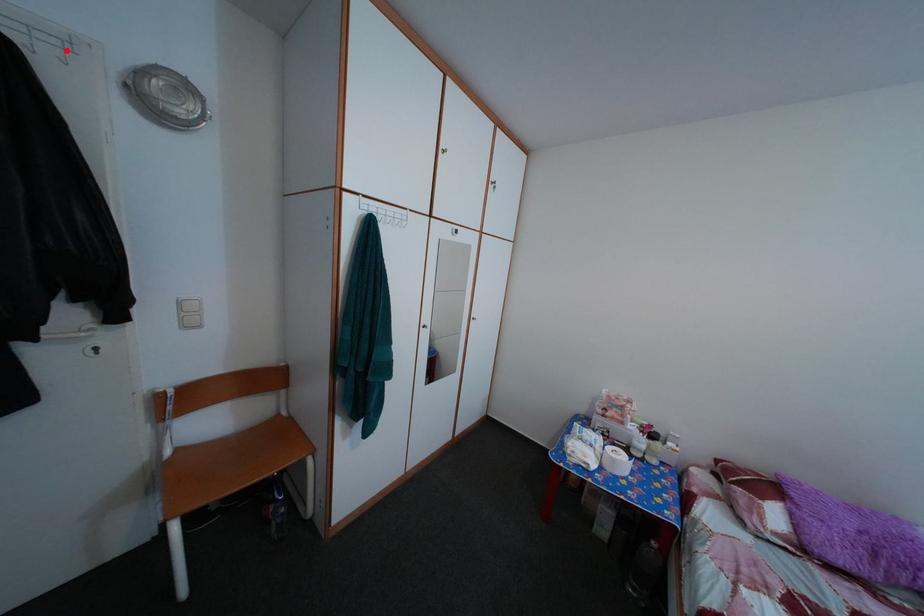
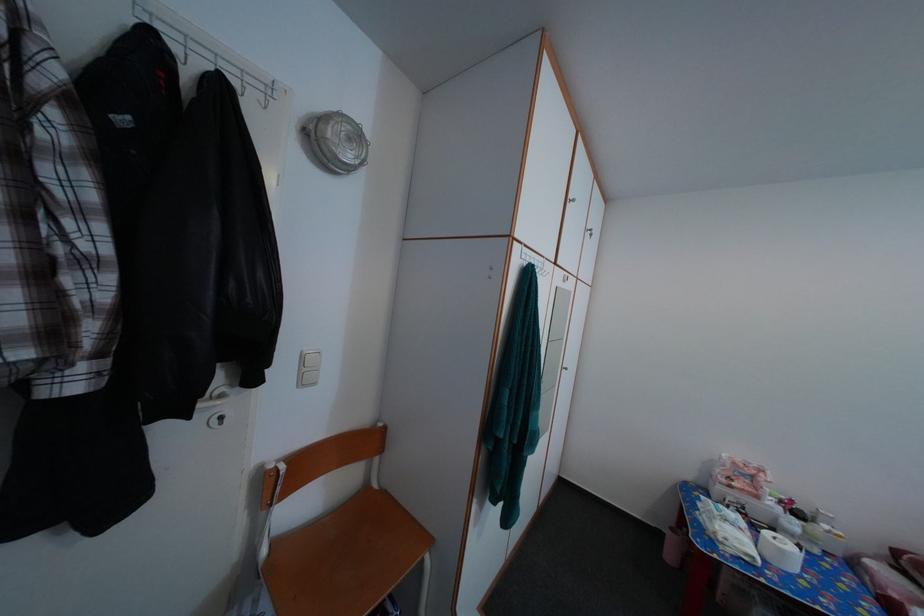
Question: I am providing you with two images of the same scene from different viewpoints. A red point is marked on the first image. At the location where the point appears in image 1, is it still visible in image 2?

Choices:
 (A) Yes
 (B) No

Answer: (A)